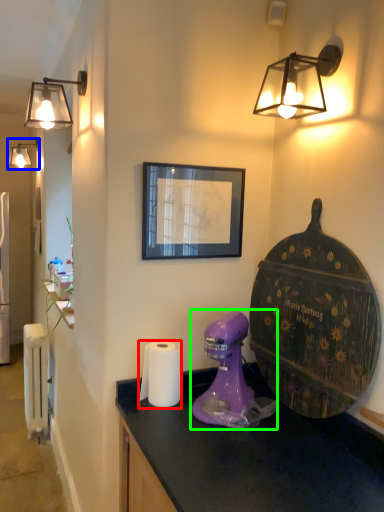
Question: Estimate the real-world distances between objects in this image. Which object is closer to toilet paper (highlighted by a red box), lamp (highlighted by a blue box) or mixer (highlighted by a green box)?

Choices:
 (A) lamp
 (B) mixer

Answer: (B)